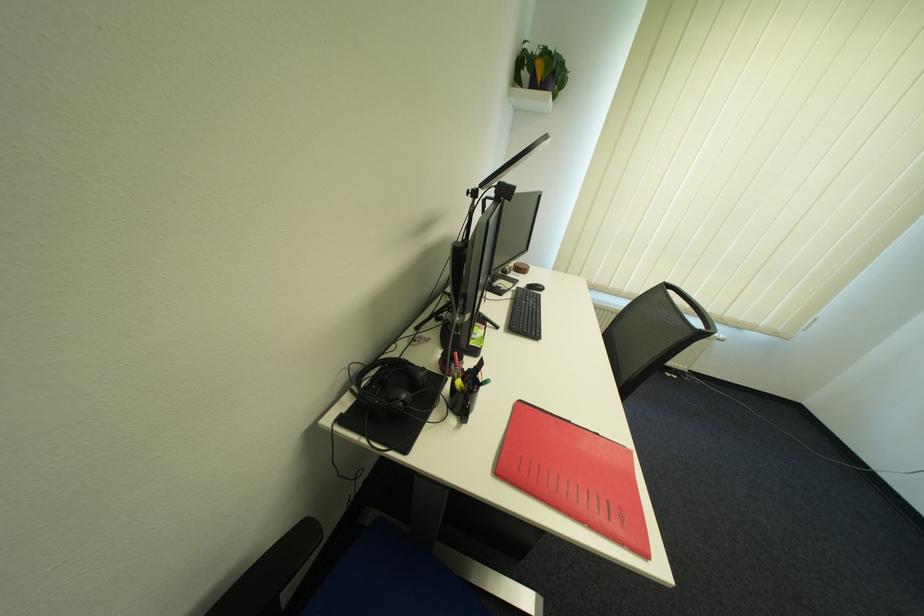
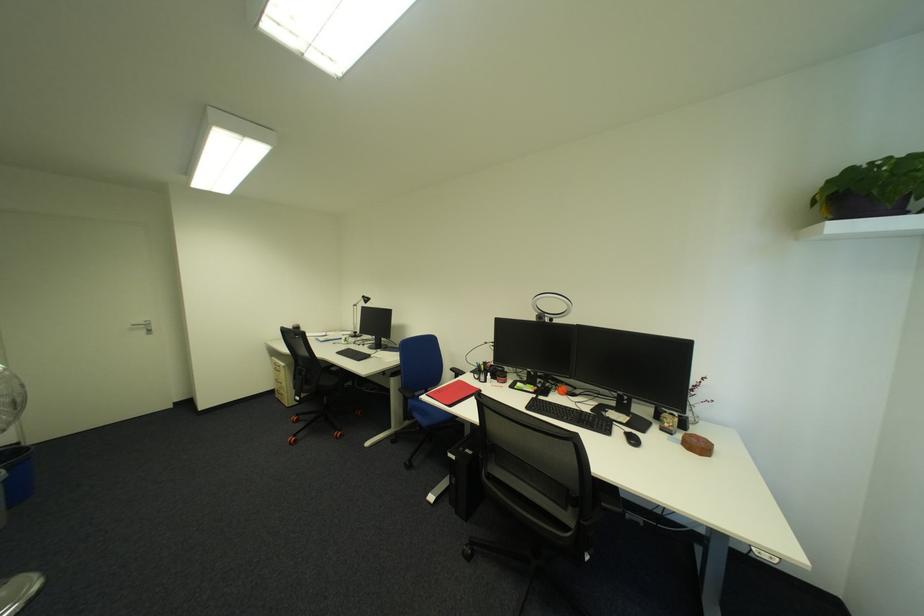
In the second image, find the point that corresponds to (517,267) in the first image.

(677, 424)